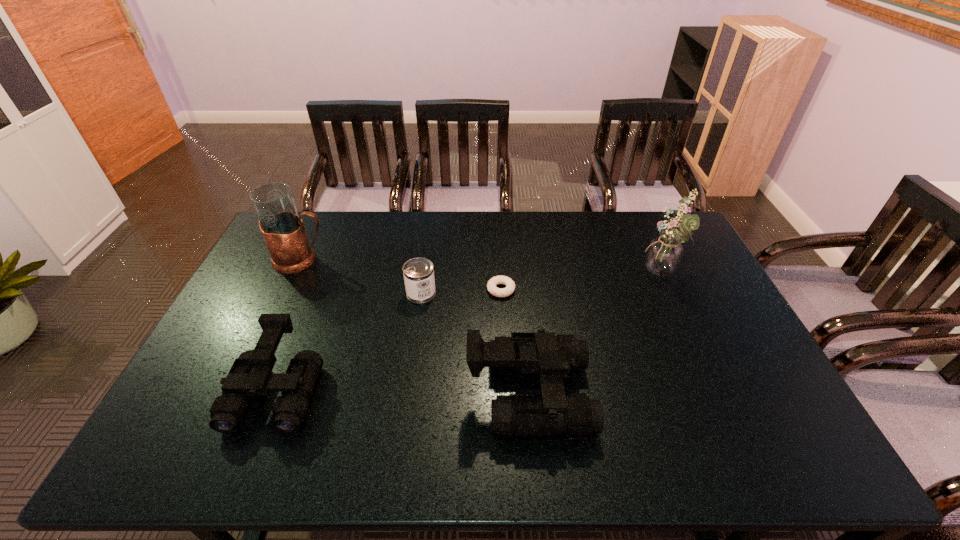
Image resolution: width=960 pixels, height=540 pixels. I want to click on object that is at the far left corner, so click(x=282, y=228).

Find the location of `object present at the near left corner`. object present at the near left corner is located at coordinates (250, 375).

The width and height of the screenshot is (960, 540). I want to click on vacant space at the far edge, so click(627, 234).

Where is `free space at the left edge of the desktop`? free space at the left edge of the desktop is located at coordinates (288, 284).

I want to click on vacant space at the right edge, so click(752, 362).

You are a GUI agent. You are given a task and a screenshot of the screen. Output one action in this format:
    pyautogui.click(x=<x>, y=<y>)
    Task: Click on the vacant space at the far right corner of the desktop
    The height and width of the screenshot is (540, 960).
    Given the screenshot: What is the action you would take?
    click(x=657, y=218)

At what (x,y) coordinates should I click in order to perform the action: click on free spot between the shorter binoculars and the shortest object. Please return your answer as a coordinate pair (x, y). The width and height of the screenshot is (960, 540). Looking at the image, I should click on (389, 340).

I want to click on free space between the bouquet and the fourth object from right to left, so click(540, 284).

You are a GUI agent. You are given a task and a screenshot of the screen. Output one action in this format:
    pyautogui.click(x=<x>, y=<y>)
    Task: Click on the vacant area that lies between the right binoculars and the pitcher
    
    Given the screenshot: What is the action you would take?
    pyautogui.click(x=415, y=327)

You are a GUI agent. You are given a task and a screenshot of the screen. Output one action in this format:
    pyautogui.click(x=<x>, y=<y>)
    Task: Click on the vacant area that lies between the second tallest object and the bouquet
    This screenshot has width=960, height=540.
    Given the screenshot: What is the action you would take?
    pyautogui.click(x=481, y=267)